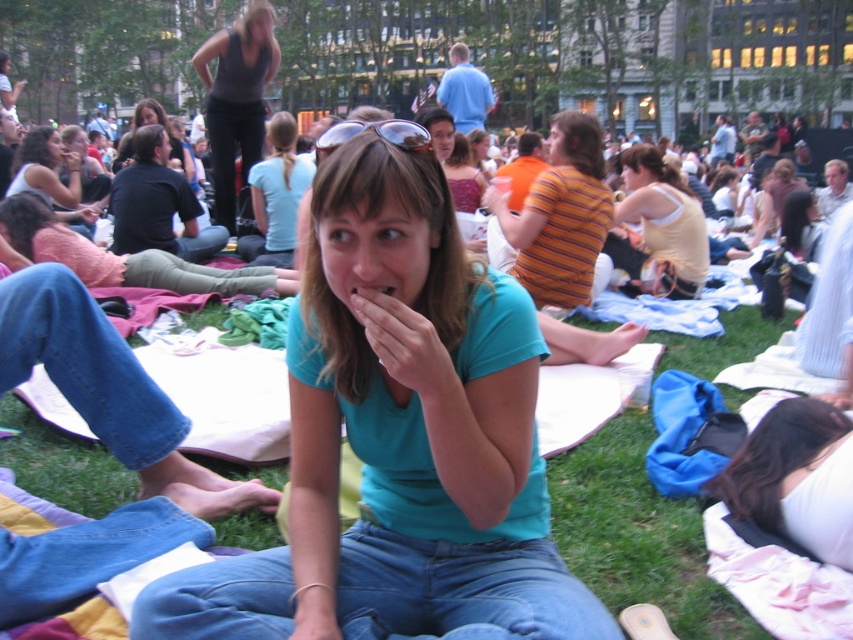
You are a photographer at the park and want to take a photo of the teal matte shirt at center and dark gray tank top at upper center. Which of the two is shorter in height?

The teal matte shirt at center is not as tall as dark gray tank top at upper center, so the teal matte shirt at center is shorter in height.